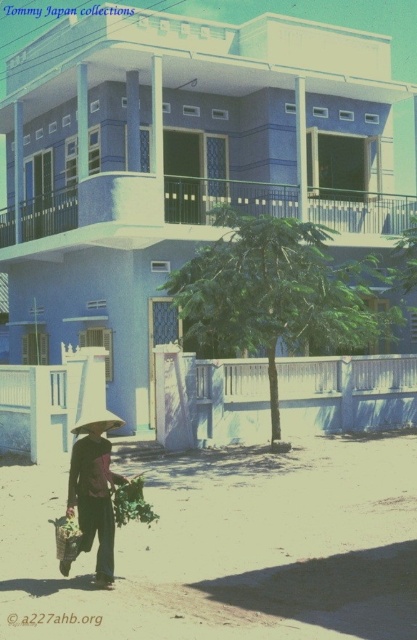
Based on the photo, is brown woven basket at lower left bigger than wooden woven basket at lower left?

Indeed, brown woven basket at lower left has a larger size compared to wooden woven basket at lower left.

At what (x,y) coordinates should I click in order to perform the action: click on brown woven basket at lower left. Please return your answer as a coordinate pair (x, y). The height and width of the screenshot is (640, 417). Looking at the image, I should click on (95, 492).

Which is below, brown woven basket at lower left or green leafy plant at lower center?

green leafy plant at lower center

This screenshot has width=417, height=640. Identify the location of brown woven basket at lower left. (95, 492).

Locate an element on the screen. The height and width of the screenshot is (640, 417). brown woven basket at lower left is located at coordinates (95, 492).

Does green leafy plant at lower center appear under wooden woven basket at lower left?

Incorrect, green leafy plant at lower center is not positioned below wooden woven basket at lower left.

Describe the element at coordinates (130, 502) in the screenshot. I see `green leafy plant at lower center` at that location.

This screenshot has height=640, width=417. I want to click on green leafy plant at lower center, so click(x=130, y=502).